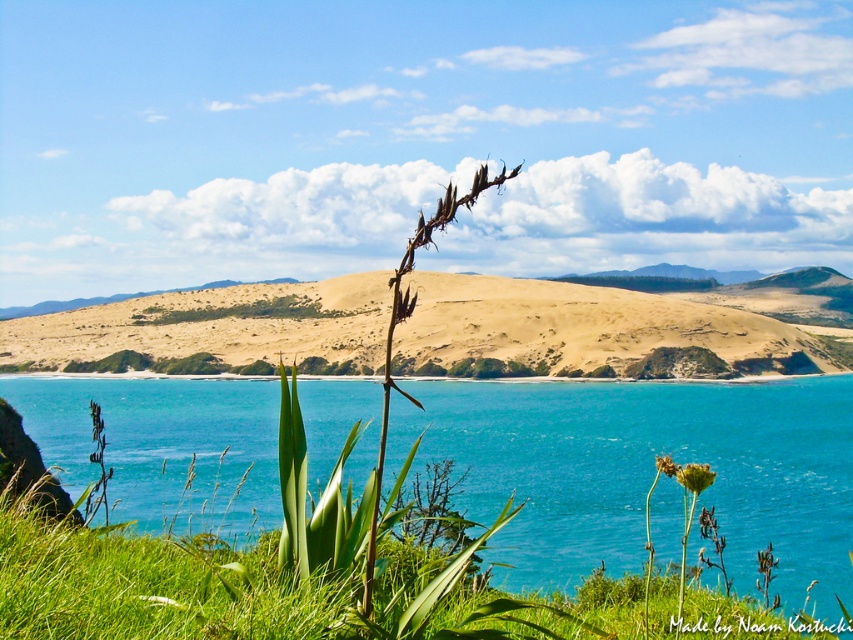
You are a photographer standing in the coastal landscape scene. You want to capture a photo where both the turquoise water at center and the yellow matte flower at center are clearly visible. Based on their sizes in the image, which object should you focus on first to ensure both are in frame?

The turquoise water at center is much taller than the yellow matte flower at center, so you should focus on the turquoise water at center first to ensure both are in frame.

You are standing at the beach and see two points marked in the image. Which point is closer to you, point (704, 355) or point (665, 472)?

Point (665, 472) is closer to you because it is less further to the camera than point (704, 355).